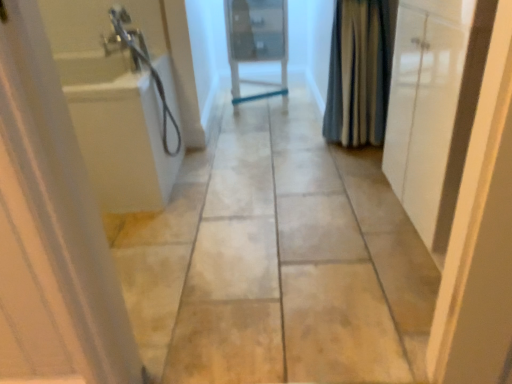
Question: From their relative heights in the image, would you say blue striped fabric at right is taller or shorter than white glossy door at left, which is counted as the first door, starting from the front?

Choices:
 (A) tall
 (B) short

Answer: (B)

Question: Does point (367, 11) appear closer or farther from the camera than point (96, 243)?

Choices:
 (A) farther
 (B) closer

Answer: (A)

Question: Which of these objects is positioned farthest from the white glossy door at left, which ranks as the 3th door in right-to-left order?

Choices:
 (A) white glossy cabinet at right, which is the 1th door from right to left
 (B) blue striped fabric at right
 (C) white glossy door at center, the second door from the left
 (D) beige tile floor at center

Answer: (C)

Question: Considering the real-world distances, which object is farthest from the white glossy door at center, the second door from the left?

Choices:
 (A) beige tile floor at center
 (B) blue striped fabric at right
 (C) white glossy cabinet at right, which is the 3th door from left to right
 (D) white glossy door at left, which ranks as the 3th door in right-to-left order

Answer: (D)